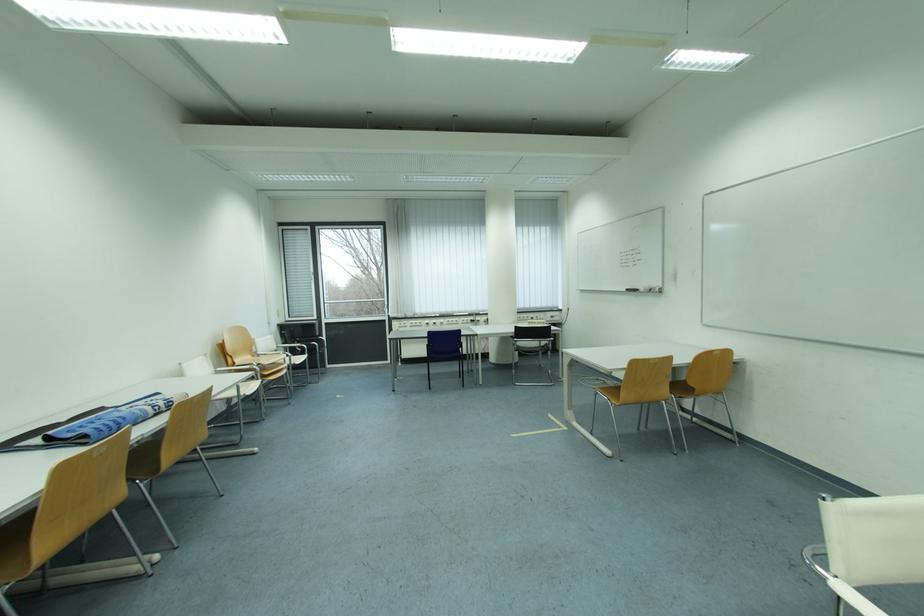
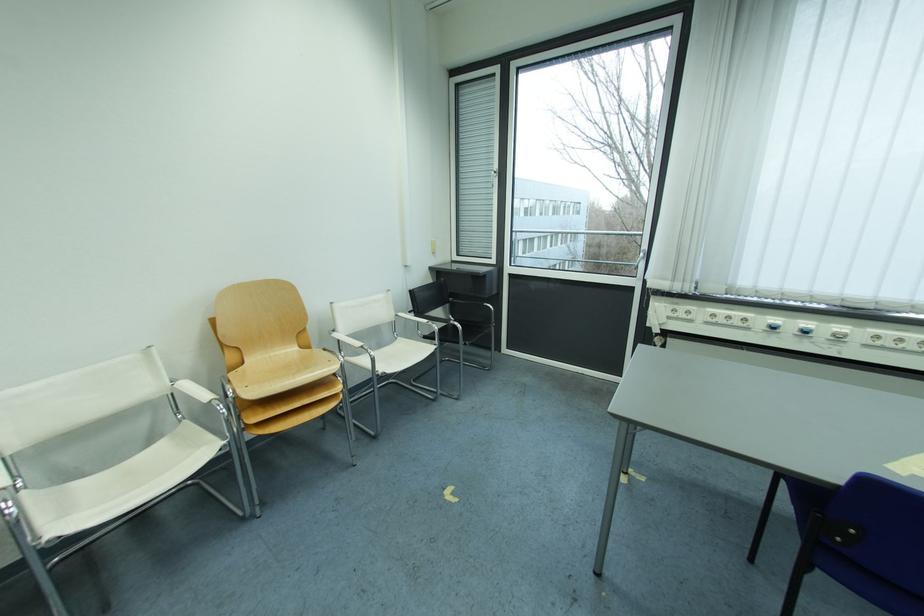
The point at (450,323) is marked in the first image. Where is the corresponding point in the second image?

(849, 330)